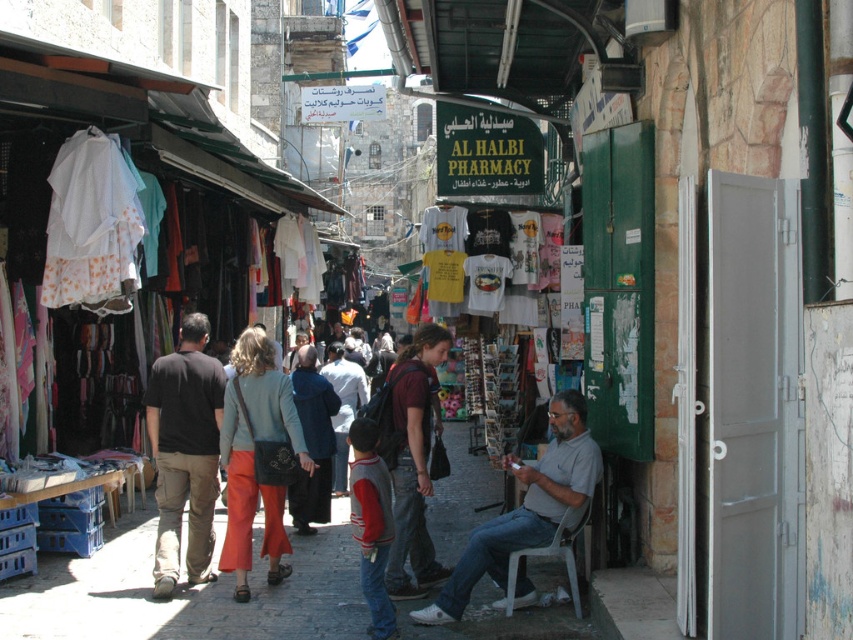
Which is above, black cotton shirt at left or gray fabric shirt at lower right?

black cotton shirt at left

Can you confirm if black cotton shirt at left is thinner than gray fabric shirt at lower right?

Correct, black cotton shirt at left's width is less than gray fabric shirt at lower right's.

Who is more forward, (169, 388) or (477, 566)?

Point (477, 566) is in front.

Locate an element on the screen. This screenshot has width=853, height=640. black cotton shirt at left is located at coordinates (184, 452).

The width and height of the screenshot is (853, 640). Find the location of `gray fabric shirt at lower right`. gray fabric shirt at lower right is located at coordinates (525, 508).

Is gray fabric shirt at lower right positioned in front of light brown leather jacket at center?

Yes, gray fabric shirt at lower right is in front of light brown leather jacket at center.

The image size is (853, 640). I want to click on gray fabric shirt at lower right, so click(525, 508).

Does black cotton shirt at left come behind light brown leather jacket at center?

No, black cotton shirt at left is closer to the viewer.

Does point (160, 509) come in front of point (346, 474)?

Yes, it is in front of point (346, 474).

The width and height of the screenshot is (853, 640). Identify the location of black cotton shirt at left. (184, 452).